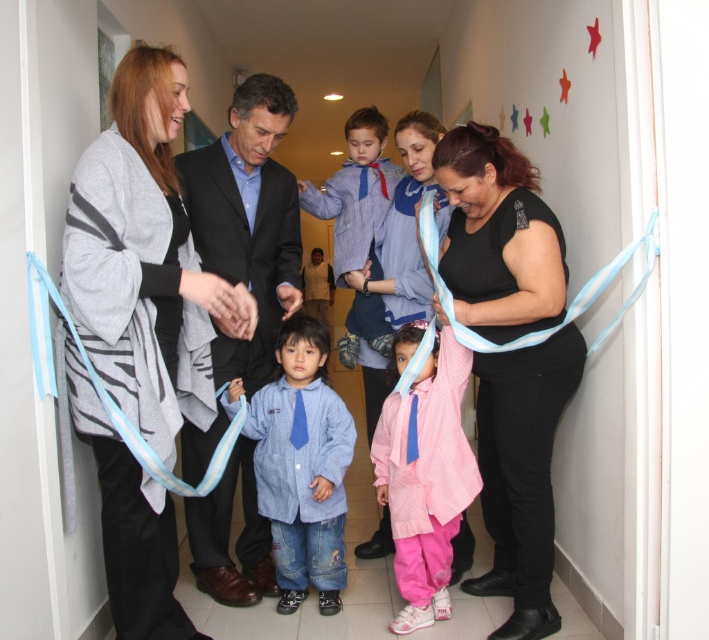
You are a photographer positioned at the end of the hallway. You need to capture a photo of the pink fabric dress at center and the blue striped shirt at center. Which one is closer to the camera?

The pink fabric dress at center is closer to the camera because it is in front of the blue striped shirt at center.